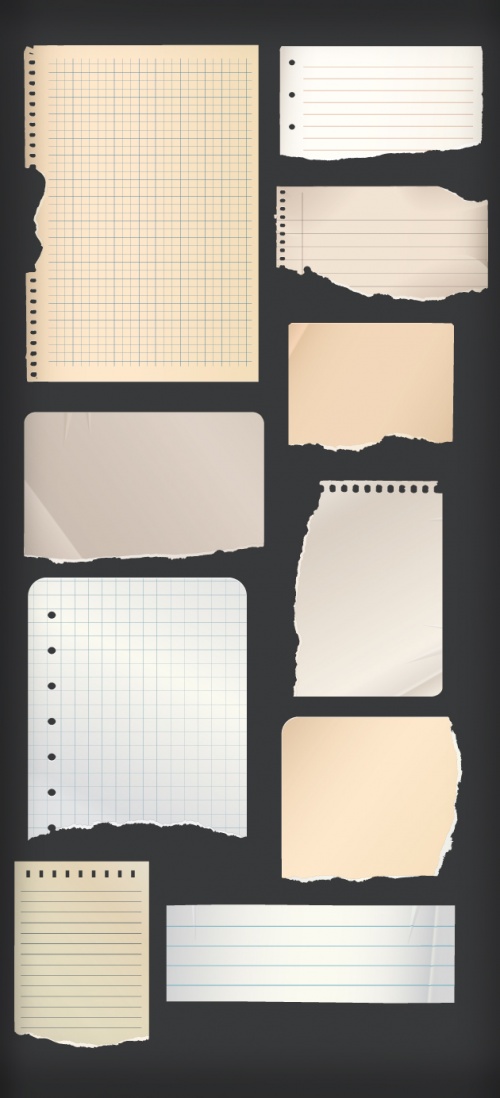
Identify the location of pieces of paper. (165, 127), (394, 93), (395, 228), (380, 381), (176, 435), (202, 658), (366, 603), (408, 791), (81, 952), (277, 965).